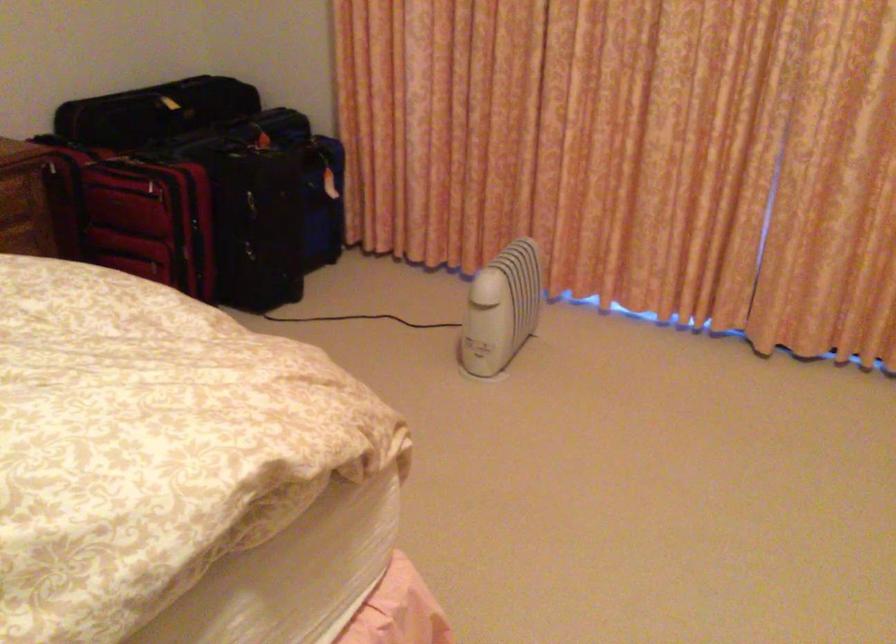
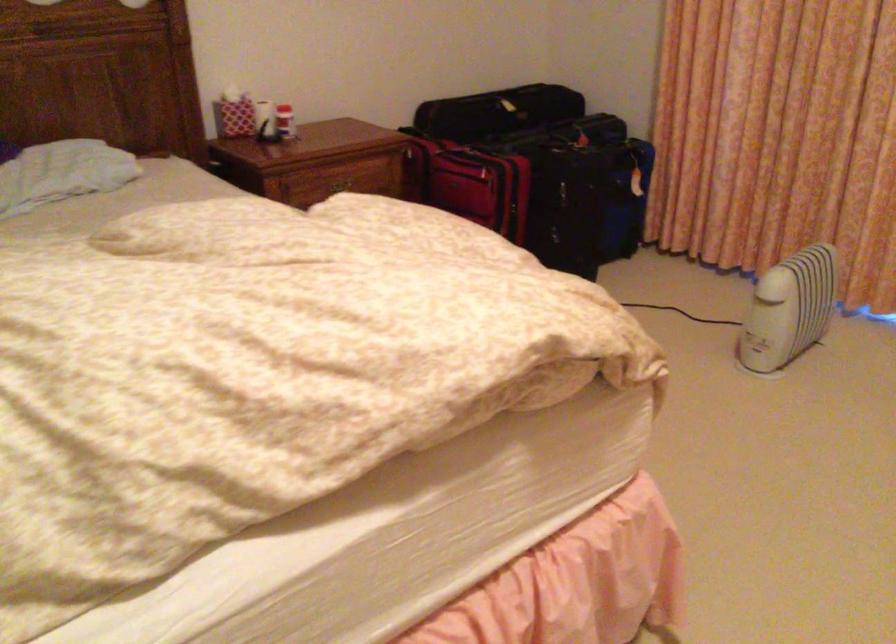
Locate, in the second image, the point that corresponds to [142,205] in the first image.

(469, 183)